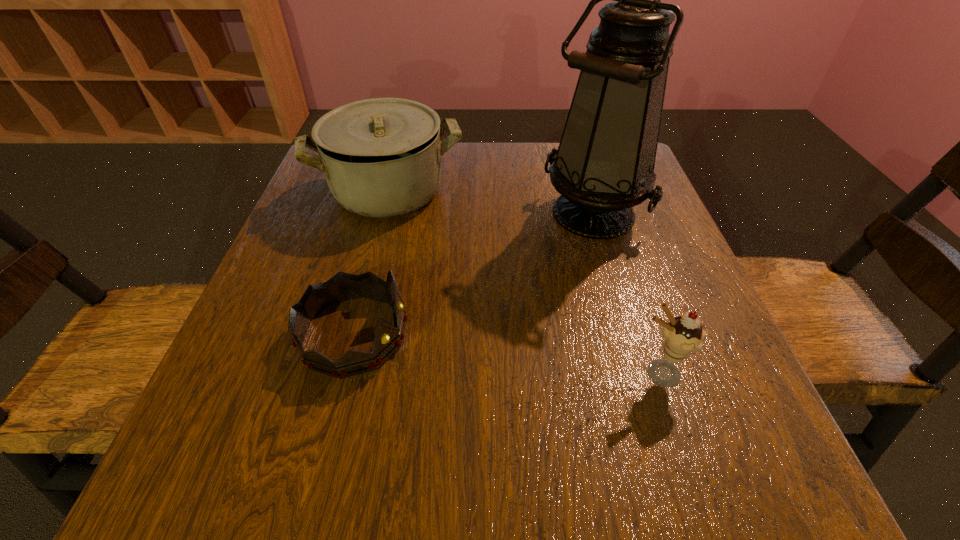
Identify the location of free space at the near left corner. (248, 435).

You are a GUI agent. You are given a task and a screenshot of the screen. Output one action in this format:
    pyautogui.click(x=<x>, y=<y>)
    Task: Click on the free space at the near right corner of the desktop
    This screenshot has height=540, width=960.
    Given the screenshot: What is the action you would take?
    pyautogui.click(x=708, y=484)

Where is `empty space that is in between the icecream and the tallest object`? Image resolution: width=960 pixels, height=540 pixels. empty space that is in between the icecream and the tallest object is located at coordinates (625, 294).

Find the location of a particular element. Image resolution: width=960 pixels, height=540 pixels. free area in between the saucepan and the tiara is located at coordinates (371, 263).

Find the location of a particular element. The image size is (960, 540). free spot between the icecream and the saucepan is located at coordinates (523, 282).

The width and height of the screenshot is (960, 540). What are the coordinates of `vacant space that is in between the tiara and the saucepan` in the screenshot? It's located at (371, 263).

Find the location of `free space between the icecream and the shortest object`. free space between the icecream and the shortest object is located at coordinates (506, 354).

Locate an element on the screen. This screenshot has height=540, width=960. unoccupied area between the icecream and the saucepan is located at coordinates (523, 282).

Locate an element on the screen. The image size is (960, 540). free area in between the tallest object and the saucepan is located at coordinates (491, 203).

Where is `unoccupied position between the tiara and the tallest object`? unoccupied position between the tiara and the tallest object is located at coordinates (473, 275).